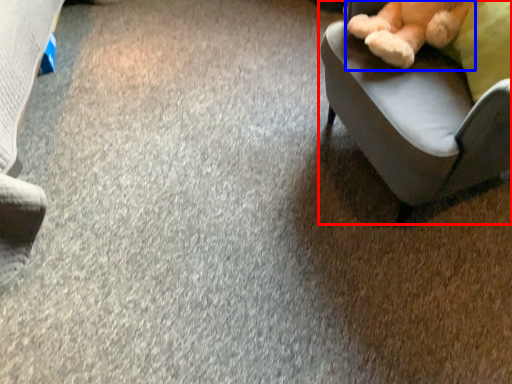
Question: Among these objects, which one is nearest to the camera, chair (highlighted by a red box) or teddy bear (highlighted by a blue box)?

Choices:
 (A) chair
 (B) teddy bear

Answer: (A)